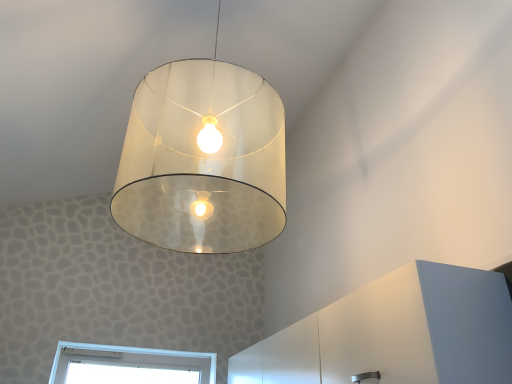
Question: Is point (452, 344) positioned closer to the camera than point (154, 180)?

Choices:
 (A) closer
 (B) farther

Answer: (A)

Question: In the image, is white matte dresser at lower right positioned in front of or behind translucent glass lampshade at center?

Choices:
 (A) front
 (B) behind

Answer: (B)

Question: In the image, is white matte dresser at lower right on the left side or the right side of translucent glass lampshade at center?

Choices:
 (A) right
 (B) left

Answer: (A)

Question: Looking at their shapes, would you say translucent glass lampshade at center is wider or thinner than white matte dresser at lower right?

Choices:
 (A) wide
 (B) thin

Answer: (A)

Question: Looking at the image, does translucent glass lampshade at center seem bigger or smaller compared to white matte dresser at lower right?

Choices:
 (A) small
 (B) big

Answer: (B)

Question: Does point (124, 198) appear closer or farther from the camera than point (480, 360)?

Choices:
 (A) farther
 (B) closer

Answer: (A)

Question: From the image's perspective, is translucent glass lampshade at center positioned above or below white matte dresser at lower right?

Choices:
 (A) below
 (B) above

Answer: (B)